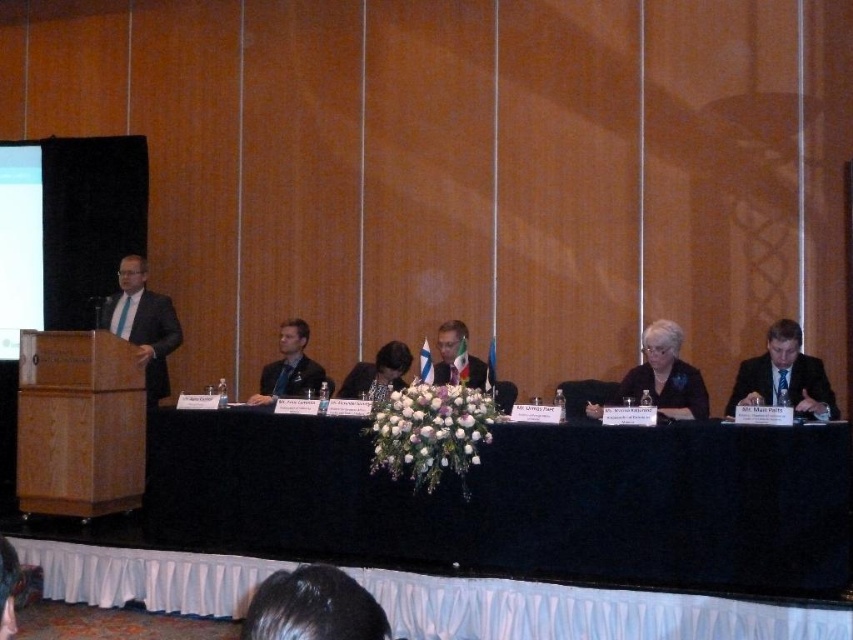
Question: Which is nearer to the dark brown suit at center?

Choices:
 (A) dark blue suit at center
 (B) blue suit at right

Answer: (A)

Question: Is matte black dress at center positioned at the back of formal suit at center?

Choices:
 (A) no
 (B) yes

Answer: (A)

Question: Based on their relative distances, which object is farther from the blue suit at right?

Choices:
 (A) matte black dress at center
 (B) dark blue suit at center
 (C) dark brown suit at center
 (D) matte black suit at left

Answer: (D)

Question: In this image, where is dark brown hair at lower center located relative to blue suit at right?

Choices:
 (A) left
 (B) right

Answer: (A)

Question: Estimate the real-world distances between objects in this image. Which object is closer to the dark brown suit at center?

Choices:
 (A) matte black suit at left
 (B) dark blue suit at center

Answer: (B)

Question: Does black fabric table at center appear under formal suit at center?

Choices:
 (A) yes
 (B) no

Answer: (A)